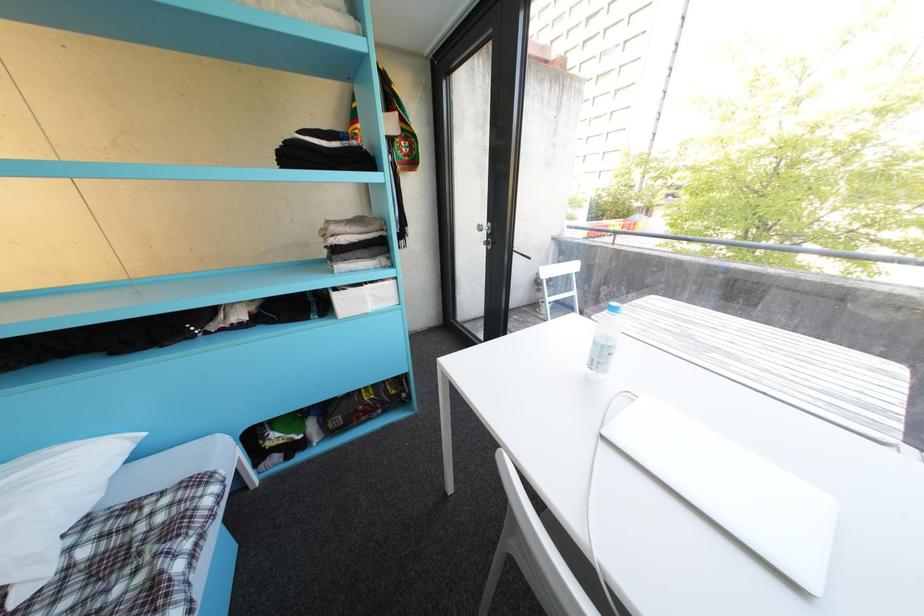
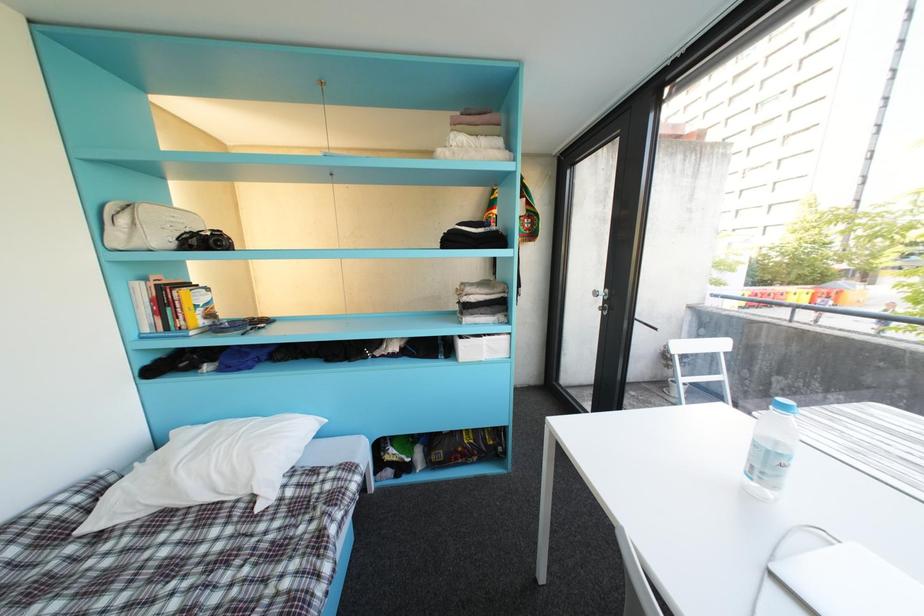
In a continuous first-person perspective shot, in which direction is the camera moving?

The cameraman walked toward left, backward.